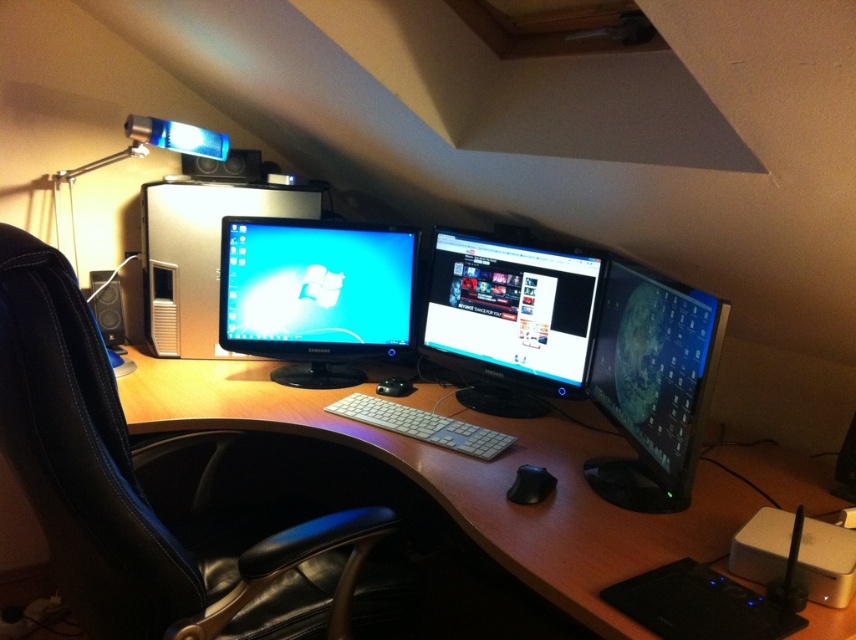
Is the position of satin black monitor at center less distant than that of white plastic keyboard at center?

No, it is behind white plastic keyboard at center.

Is satin black monitor at center further to the viewer compared to white plastic keyboard at center?

Yes, it is.

Describe the element at coordinates (509, 320) in the screenshot. I see `satin black monitor at center` at that location.

Locate an element on the screen. Image resolution: width=856 pixels, height=640 pixels. satin black monitor at center is located at coordinates pyautogui.click(x=509, y=320).

Which is above, satin black monitor at center or black rubber mouse at center?

Positioned higher is satin black monitor at center.

The image size is (856, 640). Identify the location of satin black monitor at center. (509, 320).

This screenshot has width=856, height=640. In order to click on satin black monitor at center in this screenshot , I will do `click(509, 320)`.

What are the coordinates of `satin black monitor at center` in the screenshot? It's located at pyautogui.click(x=509, y=320).

Does black leather swivel chair at left have a smaller size compared to white plastic keyboard at center?

Incorrect, black leather swivel chair at left is not smaller in size than white plastic keyboard at center.

Image resolution: width=856 pixels, height=640 pixels. I want to click on black leather swivel chair at left, so click(x=152, y=506).